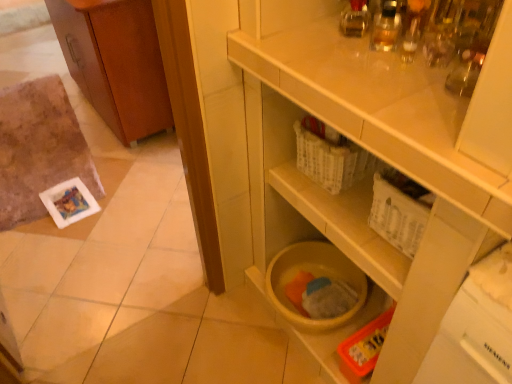
Where is `vacant area that is in front of wooden cabinet at left`? The width and height of the screenshot is (512, 384). vacant area that is in front of wooden cabinet at left is located at coordinates (122, 171).